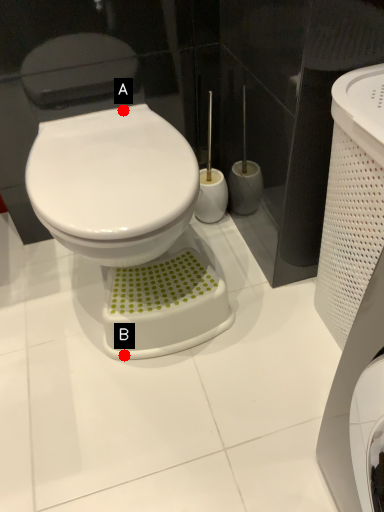
Question: Two points are circled on the image, labeled by A and B beside each circle. Which point appears closest to the camera in this image?

Choices:
 (A) A is closer
 (B) B is closer

Answer: (A)